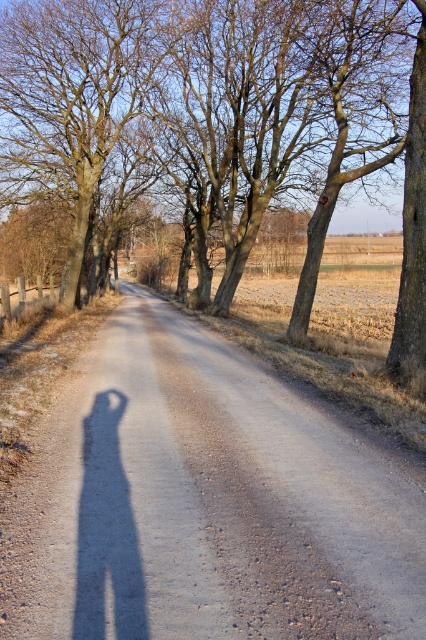
Question: Observing the image, what is the correct spatial positioning of brown bark tree at center in reference to brown rough tree at upper left?

Choices:
 (A) right
 (B) left

Answer: (A)

Question: Does dirt road at center appear over brown rough tree at upper left?

Choices:
 (A) no
 (B) yes

Answer: (A)

Question: Estimate the real-world distances between objects in this image. Which object is farther from the brown rough tree at upper left?

Choices:
 (A) dirt road at center
 (B) brown bark tree at center

Answer: (A)

Question: Which point appears closest to the camera in this image?

Choices:
 (A) (405, 470)
 (B) (51, 68)

Answer: (A)

Question: Among these points, which one is nearest to the camera?

Choices:
 (A) (206, 561)
 (B) (19, 112)

Answer: (A)

Question: Can you confirm if brown bark tree at center is positioned below brown rough tree at upper left?

Choices:
 (A) yes
 (B) no

Answer: (A)